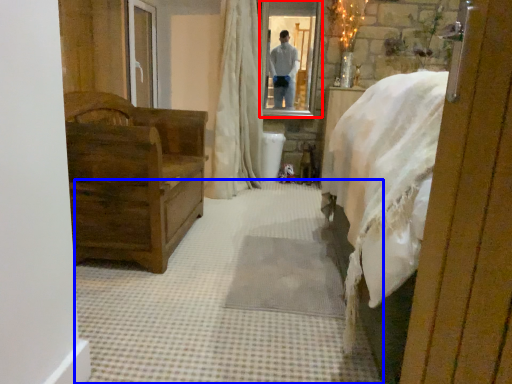
Question: Among these objects, which one is farthest to the camera, mirror (highlighted by a red box) or plain (highlighted by a blue box)?

Choices:
 (A) mirror
 (B) plain

Answer: (A)